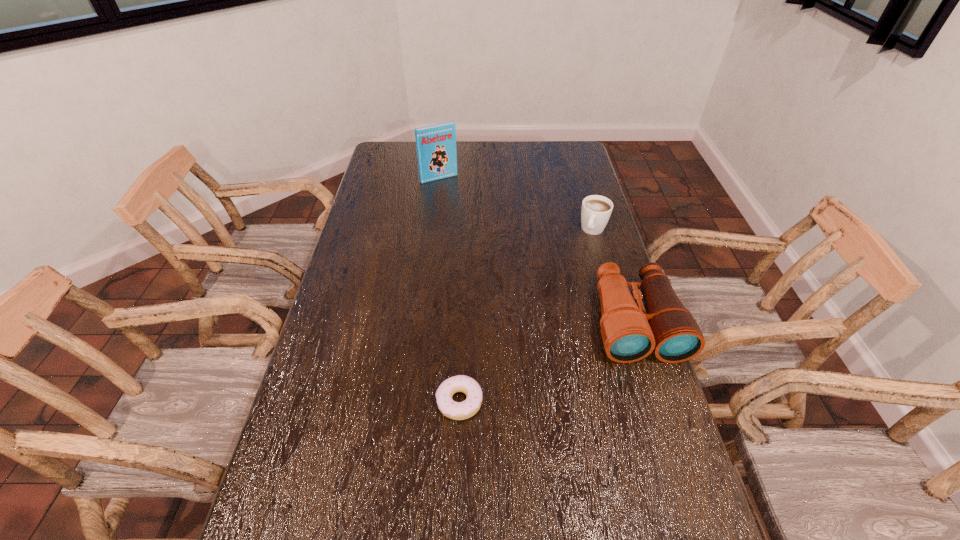
Locate an element on the screen. doughnut is located at coordinates (463, 410).

This screenshot has width=960, height=540. In order to click on the nearest object in this screenshot , I will do `click(463, 410)`.

You are a GUI agent. You are given a task and a screenshot of the screen. Output one action in this format:
    pyautogui.click(x=<x>, y=<y>)
    Task: Click on the third shortest object
    
    Given the screenshot: What is the action you would take?
    pyautogui.click(x=629, y=334)

At what (x,y) coordinates should I click in order to perform the action: click on binoculars. Please return your answer as a coordinate pair (x, y). The height and width of the screenshot is (540, 960). Looking at the image, I should click on (629, 334).

Where is `book`? This screenshot has width=960, height=540. book is located at coordinates (436, 145).

Where is `the tallest object`? the tallest object is located at coordinates (436, 145).

Identify the location of cappuccino. (596, 210).

Image resolution: width=960 pixels, height=540 pixels. I want to click on the second farthest object, so point(596,210).

Locate an element on the screen. The height and width of the screenshot is (540, 960). free region located 0.230m on the front of the doughnut is located at coordinates (455, 525).

Identify the location of vacant region located through the lenses of the binoculars. (659, 396).